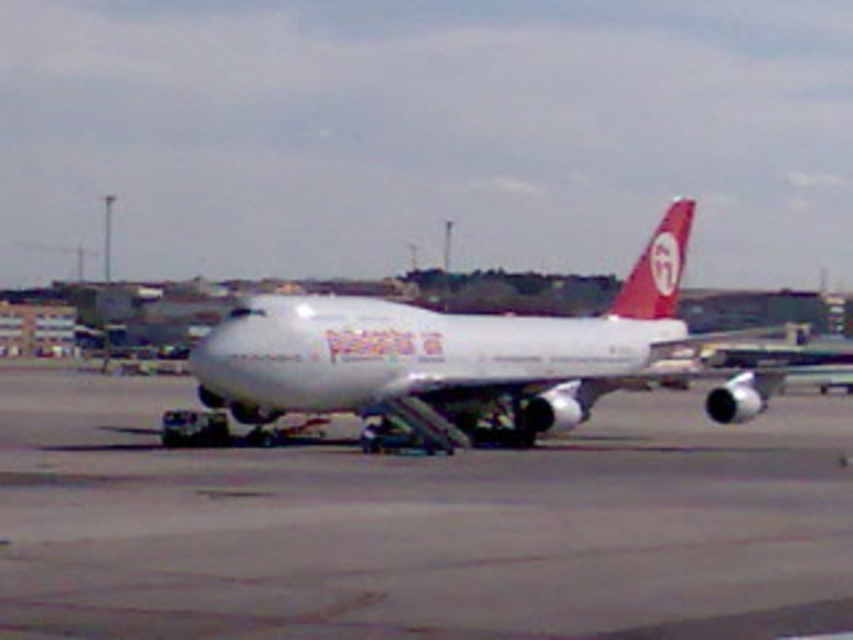
You are an airport worker standing on the gray concrete runway at center and need to reach the white glossy airliner at center for maintenance. Which direction should you walk to get there?

The gray concrete runway at center is to the left of white glossy airliner at center, so you should walk to the right to reach the white glossy airliner at center.

You are a pilot who just landed the matte red airplane tail at upper right. After landing, you need to taxi to the terminal. Which direction should you head relative to the gray concrete runway at center?

The matte red airplane tail at upper right should taxi towards the terminal by moving away from the gray concrete runway at center since the runway is lower in height compared to the airplane tail, indicating the runway is behind the plane.